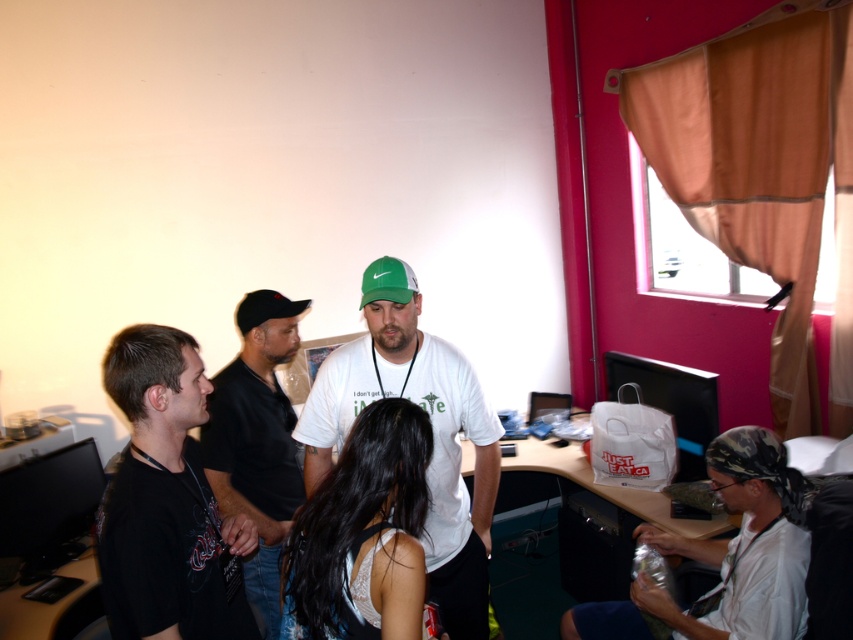
In the image, there is a green matte baseball cap at center. Can you tell me its exact 2D coordinates?

The green matte baseball cap at center is located at the 2D coordinates of point (387, 282).

You are a photographer trying to capture a group photo of the scene. You notice the green matte baseball cap at center and the black matte baseball cap at left. Which cap should you adjust to ensure both are fully visible in the frame?

You should adjust the black matte baseball cap at left because the green matte baseball cap at center is above it and might block the view of the lower positioned black matte baseball cap at left.